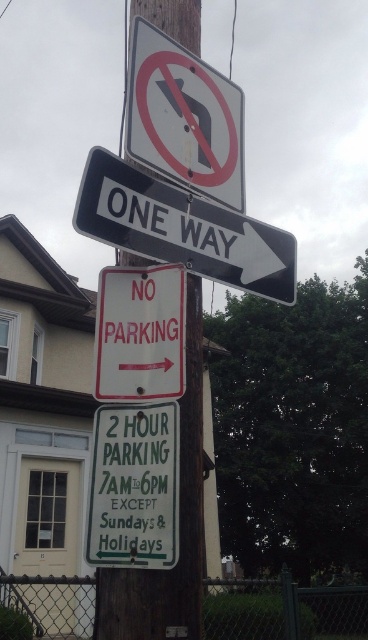
Does point (135, 61) lie in front of point (140, 451)?

No, it is not.

The image size is (368, 640). Describe the element at coordinates (184, 116) in the screenshot. I see `white plastic sign at upper center` at that location.

Is point (182, 116) positioned before point (143, 524)?

No, (182, 116) is behind (143, 524).

Find the location of a particular element. This screenshot has width=368, height=640. white plastic sign at upper center is located at coordinates (184, 116).

Who is lower down, green paper sign at lower center or red matte/no parking sign at center?

Positioned lower is green paper sign at lower center.

Image resolution: width=368 pixels, height=640 pixels. I want to click on green paper sign at lower center, so click(x=135, y=486).

I want to click on green paper sign at lower center, so click(x=135, y=486).

Identify the location of green paper sign at lower center. (x=135, y=486).

Is white plastic sign at upper center below red matte/no parking sign at center?

Incorrect, white plastic sign at upper center is not positioned below red matte/no parking sign at center.

Between point (139, 104) and point (98, 321), which one is positioned in front?

Positioned in front is point (98, 321).

The width and height of the screenshot is (368, 640). Find the location of `white plastic sign at upper center`. white plastic sign at upper center is located at coordinates (184, 116).